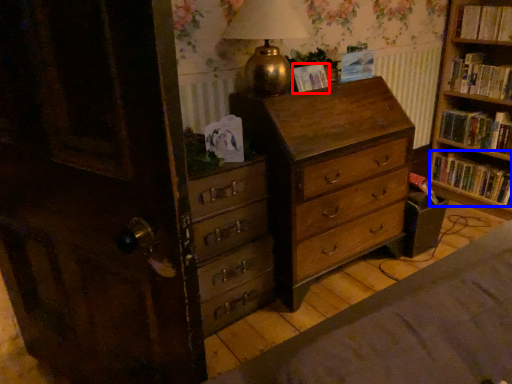
Question: Which point is further to the camera, paperback book (highlighted by a red box) or book (highlighted by a blue box)?

Choices:
 (A) paperback book
 (B) book

Answer: (B)